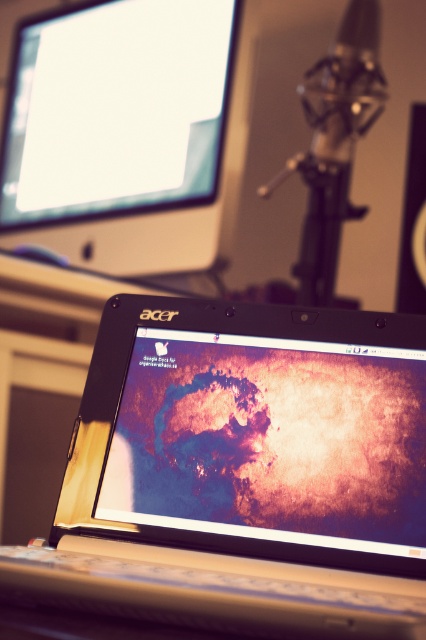
What do you see at coordinates (242, 474) in the screenshot? I see `metallic silver laptop at center` at bounding box center [242, 474].

Between point (178, 301) and point (9, 141), which one is positioned in front?

Positioned in front is point (178, 301).

At what (x,y) coordinates should I click in order to perform the action: click on metallic silver laptop at center. Please return your answer as a coordinate pair (x, y). The image size is (426, 640). Looking at the image, I should click on (242, 474).

Is matte black monitor at upper left thinner than metallic silver speaker at center?

No, matte black monitor at upper left is not thinner than metallic silver speaker at center.

Is matte black monitor at upper left behind metallic silver speaker at center?

Yes, matte black monitor at upper left is behind metallic silver speaker at center.

This screenshot has width=426, height=640. Identify the location of matte black monitor at upper left. (123, 132).

Find the location of `matte black monitor at upper left`. matte black monitor at upper left is located at coordinates (123, 132).

Describe the element at coordinates (242, 474) in the screenshot. The height and width of the screenshot is (640, 426). I see `metallic silver laptop at center` at that location.

Between metallic silver laptop at center and metallic silver speaker at center, which one has more height?

With more height is metallic silver speaker at center.

Is point (301, 548) in front of point (417, 125)?

Yes.

The height and width of the screenshot is (640, 426). In order to click on metallic silver laptop at center in this screenshot , I will do `click(242, 474)`.